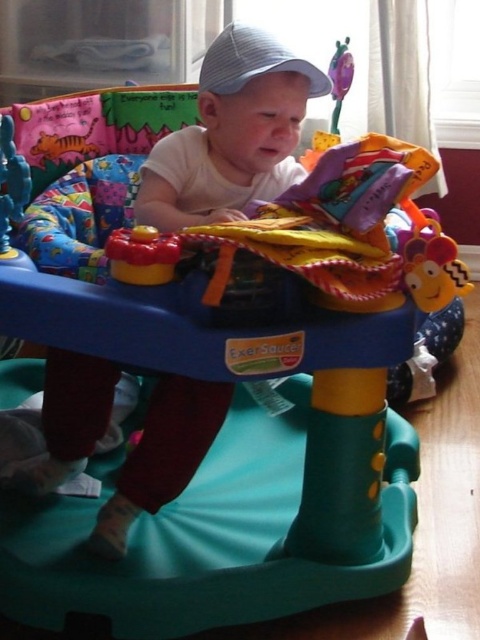
You are a photographer taking a picture of the baby in the activity center. You notice a point at coordinates (189, 157). Where exactly is this point located on the baby?

The point at coordinates (189, 157) is on the white cotton baby at center.

You are a parent observing your baby playing with the rubberized yellow and red toy at center and the rubberized plastic toy at center in the activity center. Which toy is shorter?

The rubberized yellow and red toy at center is shorter than the rubberized plastic toy at center.